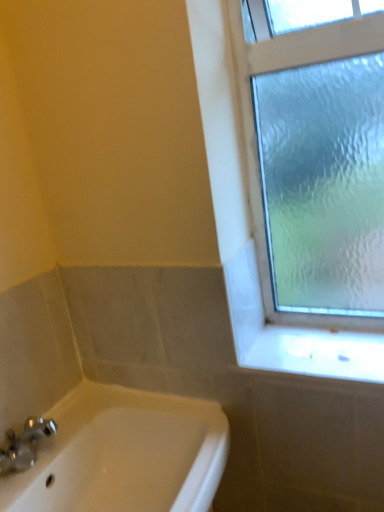
Describe the element at coordinates (124, 454) in the screenshot. The height and width of the screenshot is (512, 384). I see `white glossy bathtub at lower left` at that location.

In order to click on white glossy bathtub at lower left in this screenshot , I will do `click(124, 454)`.

Measure the distance between white glossy bathtub at lower left and camera.

The distance of white glossy bathtub at lower left from camera is 29.58 inches.

In order to face white glossy bathtub at lower left, should I rotate leftwards or rightwards?

It's best to rotate left around 11.332 degrees.

The width and height of the screenshot is (384, 512). What are the coordinates of `white glossy bathtub at lower left` in the screenshot? It's located at (124, 454).